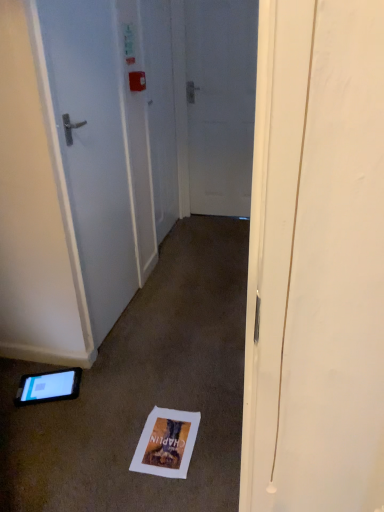
Identify the location of vacant point above black glossy tablet at lower left (from a real-world perspective). (43, 383).